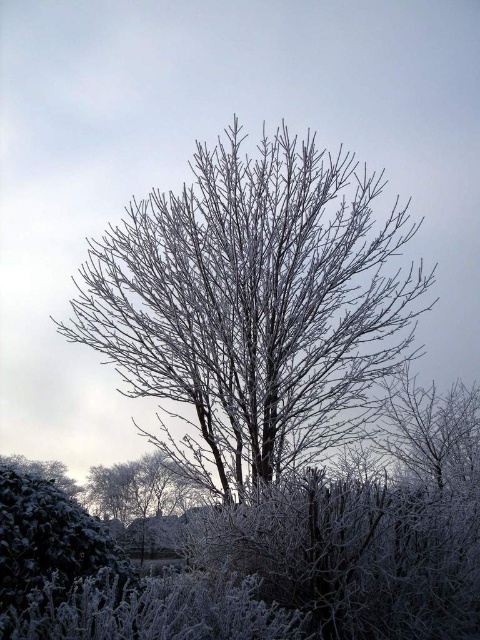
Question: Is frosted branches at center below green matte bush at lower left?

Choices:
 (A) no
 (B) yes

Answer: (A)

Question: Does frosted branches at center appear under green matte bush at lower left?

Choices:
 (A) no
 (B) yes

Answer: (A)

Question: Which of the following is the closest to the observer?

Choices:
 (A) frosted branches at center
 (B) green matte bush at lower left

Answer: (B)

Question: Among these objects, which one is farthest from the camera?

Choices:
 (A) frosted branches at center
 (B) green matte bush at lower left

Answer: (A)

Question: Does frosted branches at center appear on the left side of green matte bush at lower left?

Choices:
 (A) no
 (B) yes

Answer: (A)